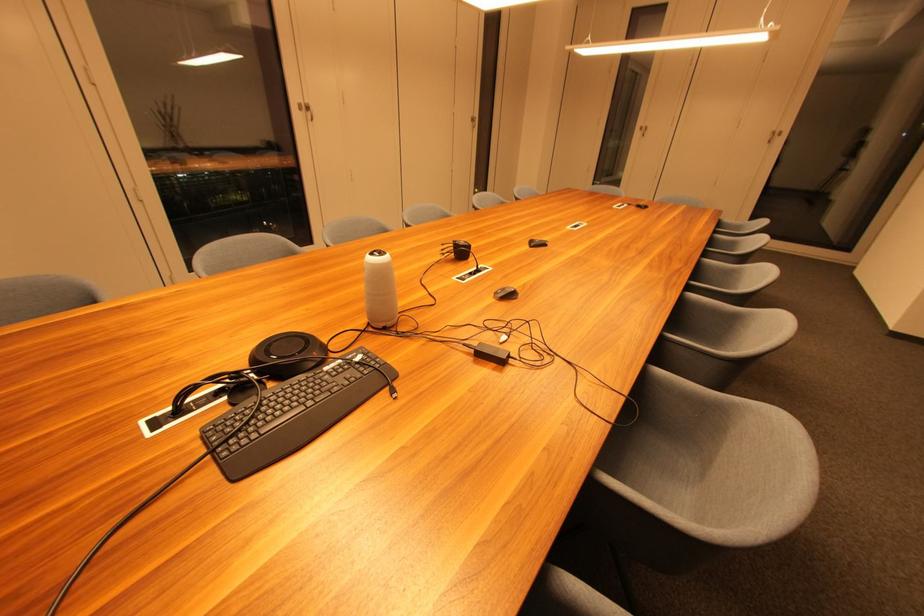
Where would you lift the black keyboard? Please return your answer as a coordinate pair (x, y).

(293, 413)